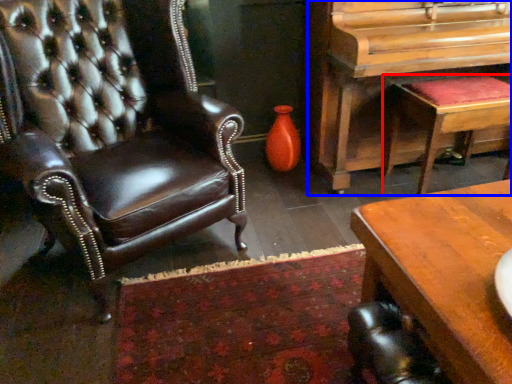
Question: Which of the following is the closest to the observer, stool (highlighted by a red box) or piano (highlighted by a blue box)?

Choices:
 (A) stool
 (B) piano

Answer: (B)